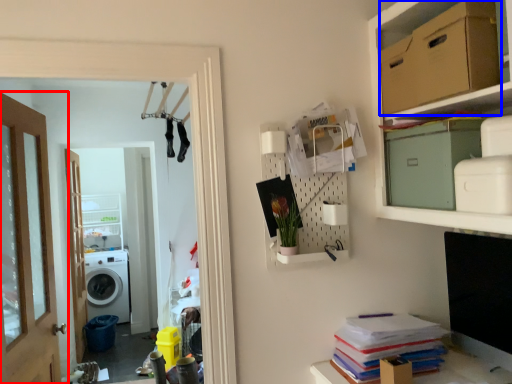
Question: Which object is further to the camera taking this photo, door (highlighted by a red box) or cardboard box (highlighted by a blue box)?

Choices:
 (A) door
 (B) cardboard box

Answer: (A)